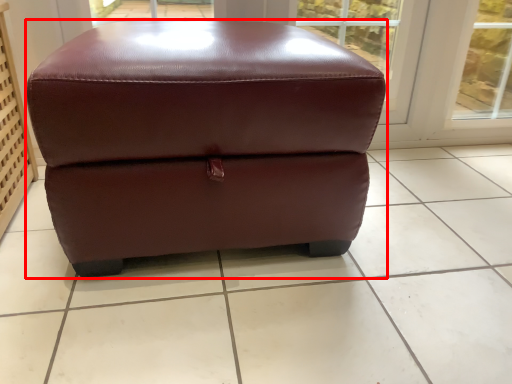
Question: Where is furniture (annotated by the red box) located in relation to tile in the image?

Choices:
 (A) left
 (B) right

Answer: (A)